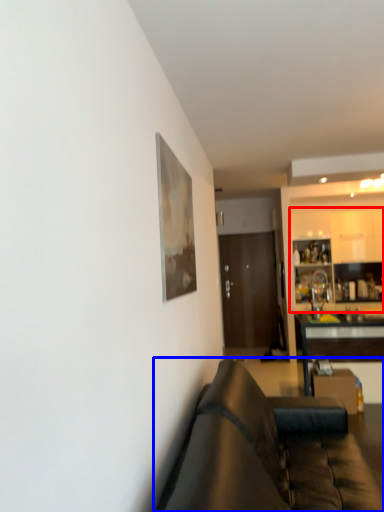
Question: Among these objects, which one is farthest to the camera, cabinetry (highlighted by a red box) or studio couch (highlighted by a blue box)?

Choices:
 (A) cabinetry
 (B) studio couch

Answer: (A)